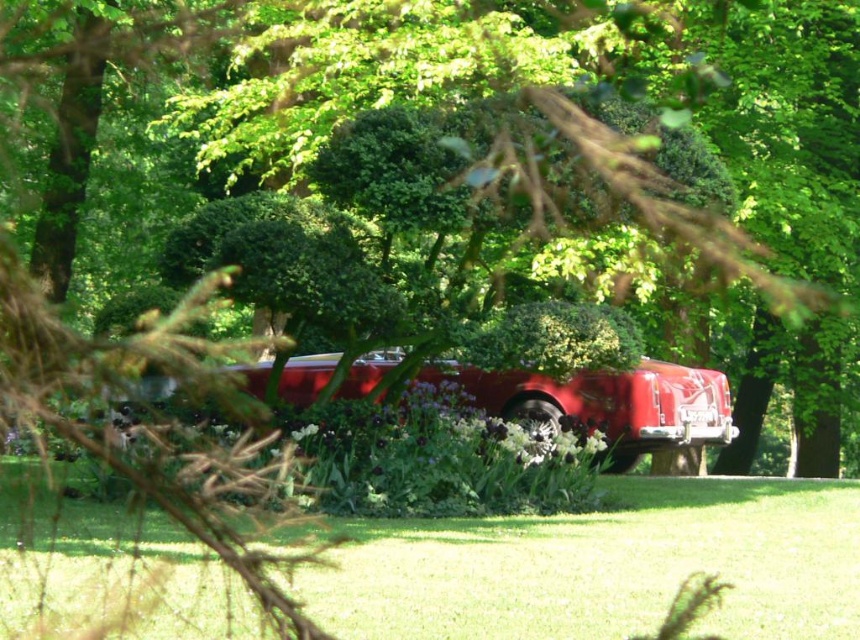
Which is behind, point (410, 566) or point (613, 426)?

The point (613, 426) is behind.

Is point (602, 566) farther from viewer compared to point (699, 412)?

No, (602, 566) is in front of (699, 412).

I want to click on green grass at lower center, so click(603, 564).

Is glossy red car at center positioned before green leafy bush at center?

No, glossy red car at center is further to the viewer.

Where is `glossy red car at center`? glossy red car at center is located at coordinates (605, 403).

Does green leafy tree at center have a larger size compared to glossy red car at center?

Yes.

Which is more to the right, green leafy tree at center or glossy red car at center?

glossy red car at center

Which is in front, point (64, 8) or point (484, 388)?

Point (64, 8) is more forward.

Find the location of a particular element. The image size is (860, 640). green leafy tree at center is located at coordinates (602, 188).